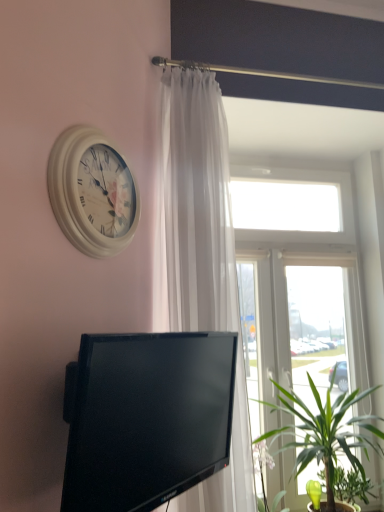
The image size is (384, 512). Describe the element at coordinates (92, 192) in the screenshot. I see `white wooden clock at upper left` at that location.

Where is `white sheer curtain at upper center`? white sheer curtain at upper center is located at coordinates (200, 258).

What do you see at coordinates (325, 431) in the screenshot? I see `green leafy plant at lower right` at bounding box center [325, 431].

Describe the element at coordinates (351, 486) in the screenshot. I see `green leafy plant at lower right` at that location.

You are a GUI agent. You are given a task and a screenshot of the screen. Output one action in this format:
    pyautogui.click(x=<x>, y=<y>)
    Task: Click on the black glossy tv at lower center
    
    Given the screenshot: What is the action you would take?
    pyautogui.click(x=146, y=418)

Where is `white wooden clock at upper left`? The image size is (384, 512). white wooden clock at upper left is located at coordinates (92, 192).

From a real-world perspective, who is located lower, black glossy tv at lower center or white wooden clock at upper left?

In real-world perspective, black glossy tv at lower center is lower.

From the image's perspective, which one is positioned lower, black glossy tv at lower center or white wooden clock at upper left?

black glossy tv at lower center appears lower in the image.

Who is bigger, black glossy tv at lower center or white wooden clock at upper left?

black glossy tv at lower center is bigger.

Considering the sizes of black glossy tv at lower center and white wooden clock at upper left in the image, is black glossy tv at lower center taller or shorter than white wooden clock at upper left?

Clearly, black glossy tv at lower center is taller compared to white wooden clock at upper left.

Can we say green leafy plant at lower right lies outside transparent glass window at upper center?

Actually, green leafy plant at lower right is at least partially inside transparent glass window at upper center.

From the image's perspective, which is above, green leafy plant at lower right or transparent glass window at upper center?

transparent glass window at upper center appears higher in the image.

How many degrees apart are the facing directions of green leafy plant at lower right and transparent glass window at upper center?

2.17e-05 degrees separate the facing orientations of green leafy plant at lower right and transparent glass window at upper center.

Measure the distance from green leafy plant at lower right to transparent glass window at upper center.

green leafy plant at lower right is 27.91 inches from transparent glass window at upper center.

Between green leafy plant at lower right and white sheer curtain at upper center, which one is positioned behind?

green leafy plant at lower right is further from the camera.

Is green leafy plant at lower right smaller than white sheer curtain at upper center?

Yes, green leafy plant at lower right is smaller than white sheer curtain at upper center.

From a real-world perspective, which object rests below the other?

From a 3D spatial view, green leafy plant at lower right is below.

Considering the points (367, 490) and (232, 302), which point is behind, point (367, 490) or point (232, 302)?

The point (367, 490) is more distant.

Which of these two, green leafy plant at lower right or white sheer curtain at upper center, stands shorter?

Standing shorter between the two is green leafy plant at lower right.

Locate an element on the screen. This screenshot has width=384, height=512. curtain lying above the green leafy plant at lower right (from the image's perspective) is located at coordinates (200, 258).

Can you confirm if green leafy plant at lower right is thinner than white sheer curtain at upper center?

In fact, green leafy plant at lower right might be wider than white sheer curtain at upper center.

Is green leafy plant at lower right smaller than white sheer curtain at upper center?

No.

Who is bigger, green leafy plant at lower right or white wooden clock at upper left?

With larger size is white wooden clock at upper left.

At what (x,y) coordinates should I click in order to perform the action: click on plant on the right of white wooden clock at upper left. Please return your answer as a coordinate pair (x, y). The image size is (384, 512). Looking at the image, I should click on (351, 486).

Is green leafy plant at lower right situated inside white wooden clock at upper left or outside?

green leafy plant at lower right is located beyond the bounds of white wooden clock at upper left.

From the image's perspective, is green leafy plant at lower right above white wooden clock at upper left?

No, from the image's perspective, green leafy plant at lower right is not over white wooden clock at upper left.

Considering the sizes of white wooden clock at upper left and white sheer curtain at upper center in the image, is white wooden clock at upper left bigger or smaller than white sheer curtain at upper center?

Clearly, white wooden clock at upper left is smaller in size than white sheer curtain at upper center.

Is white wooden clock at upper left inside or outside of white sheer curtain at upper center?

white wooden clock at upper left is spatially situated outside white sheer curtain at upper center.

Between white wooden clock at upper left and white sheer curtain at upper center, which one is positioned in front?

Positioned in front is white wooden clock at upper left.

From a real-world perspective, which is physically below, white wooden clock at upper left or white sheer curtain at upper center?

From a 3D spatial view, white sheer curtain at upper center is below.

Considering the sizes of objects white sheer curtain at upper center and green leafy plant at lower right in the image provided, who is taller, white sheer curtain at upper center or green leafy plant at lower right?

white sheer curtain at upper center is taller.

Looking at this image, would you say white sheer curtain at upper center is outside green leafy plant at lower right?

Absolutely, white sheer curtain at upper center is external to green leafy plant at lower right.

Where is `curtain that appears above the green leafy plant at lower right (from the image's perspective)`? This screenshot has height=512, width=384. curtain that appears above the green leafy plant at lower right (from the image's perspective) is located at coordinates (200, 258).

At what (x,y) coordinates should I click in order to perform the action: click on wall clock positioned vertically above the black glossy tv at lower center (from a real-world perspective). Please return your answer as a coordinate pair (x, y). Image resolution: width=384 pixels, height=512 pixels. Looking at the image, I should click on (92, 192).

Image resolution: width=384 pixels, height=512 pixels. What are the coordinates of `plant lying on the right of transparent glass window at upper center` in the screenshot? It's located at (351, 486).

Which object lies further to the anchor point green leafy plant at lower right, transparent glass window at upper center or white wooden clock at upper left?

white wooden clock at upper left lies further to green leafy plant at lower right than the other object.

Based on their spatial positions, is green leafy plant at lower right or white sheer curtain at upper center closer to transparent glass window at upper center?

white sheer curtain at upper center is closer to transparent glass window at upper center.

From the image, which object appears to be nearer to black glossy tv at lower center, white sheer curtain at upper center or transparent glass window at upper center?

white sheer curtain at upper center.

Considering their positions, is green leafy plant at lower right positioned further to white wooden clock at upper left than white sheer curtain at upper center?

Among the two, green leafy plant at lower right is located further to white wooden clock at upper left.

Considering their positions, is transparent glass window at upper center positioned closer to white sheer curtain at upper center than green leafy plant at lower right?

green leafy plant at lower right is closer to white sheer curtain at upper center.

When comparing their distances from white sheer curtain at upper center, does transparent glass window at upper center or black glossy tv at lower center seem closer?

Based on the image, black glossy tv at lower center appears to be nearer to white sheer curtain at upper center.

Considering their positions, is white wooden clock at upper left positioned closer to black glossy tv at lower center than green leafy plant at lower right?

white wooden clock at upper left is closer to black glossy tv at lower center.

From the image, which object appears to be nearer to green leafy plant at lower right, white wooden clock at upper left or black glossy tv at lower center?

Based on the image, black glossy tv at lower center appears to be nearer to green leafy plant at lower right.

Where is `plant between black glossy tv at lower center and transparent glass window at upper center along the z-axis`? plant between black glossy tv at lower center and transparent glass window at upper center along the z-axis is located at coordinates (351, 486).

The height and width of the screenshot is (512, 384). In order to click on curtain located between black glossy tv at lower center and transparent glass window at upper center in the depth direction in this screenshot , I will do `click(200, 258)`.

Where is `houseplant that lies between transparent glass window at upper center and green leafy plant at lower right from top to bottom`? houseplant that lies between transparent glass window at upper center and green leafy plant at lower right from top to bottom is located at coordinates (325, 431).

You are a GUI agent. You are given a task and a screenshot of the screen. Output one action in this format:
    pyautogui.click(x=<x>, y=<y>)
    Task: Click on the window between white sheer curtain at upper center and green leafy plant at lower right in the up-down direction
    This screenshot has width=384, height=512.
    Given the screenshot: What is the action you would take?
    pyautogui.click(x=305, y=289)